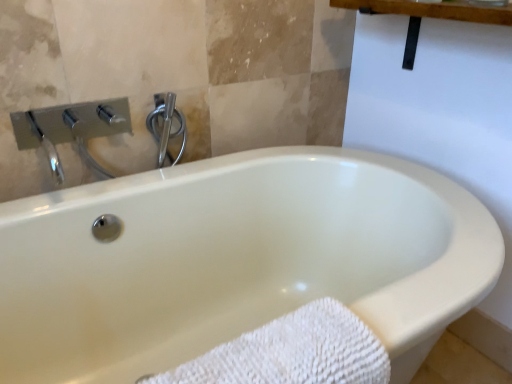
Describe the element at coordinates (166, 126) in the screenshot. This screenshot has width=512, height=384. I see `chrome/metallic shower handle at upper center` at that location.

This screenshot has height=384, width=512. I want to click on chrome/metallic shower handle at upper center, so click(166, 126).

What do you see at coordinates (292, 352) in the screenshot?
I see `white textured towel at lower left` at bounding box center [292, 352].

I want to click on white textured towel at lower left, so click(292, 352).

Locate an element on the screen. The image size is (512, 384). chrome/metallic shower handle at upper center is located at coordinates (166, 126).

Would you say white textured towel at lower left is to the left or to the right of chrome/metallic shower handle at upper center in the picture?

In the image, white textured towel at lower left appears on the right side of chrome/metallic shower handle at upper center.

Between white textured towel at lower left and chrome/metallic shower handle at upper center, which one is positioned in front?

white textured towel at lower left is in front.

Is point (368, 350) closer or farther from the camera than point (156, 123)?

Point (368, 350) is closer to the camera than point (156, 123).

From the picture: From the image's perspective, between white textured towel at lower left and chrome/metallic shower handle at upper center, who is located below?

white textured towel at lower left appears lower in the image.

From a real-world perspective, is white textured towel at lower left beneath chrome/metallic shower handle at upper center?

Yes, from a real-world perspective, white textured towel at lower left is below chrome/metallic shower handle at upper center.

Considering the sizes of white textured towel at lower left and chrome/metallic shower handle at upper center in the image, is white textured towel at lower left wider or thinner than chrome/metallic shower handle at upper center?

Clearly, white textured towel at lower left has more width compared to chrome/metallic shower handle at upper center.

Is white textured towel at lower left shorter than chrome/metallic shower handle at upper center?

No.

Is white textured towel at lower left smaller than chrome/metallic shower handle at upper center?

Actually, white textured towel at lower left might be larger than chrome/metallic shower handle at upper center.

Choose the correct answer: Is white textured towel at lower left inside chrome/metallic shower handle at upper center or outside it?

white textured towel at lower left is located beyond the bounds of chrome/metallic shower handle at upper center.

Is white textured towel at lower left not near chrome/metallic shower handle at upper center?

No.

Could you tell me if white textured towel at lower left is facing chrome/metallic shower handle at upper center?

No, white textured towel at lower left is not aimed at chrome/metallic shower handle at upper center.

Can you tell me how much white textured towel at lower left and chrome/metallic shower handle at upper center differ in facing direction?

The angle between the facing direction of white textured towel at lower left and the facing direction of chrome/metallic shower handle at upper center is 0.0691 degrees.

How far apart are white textured towel at lower left and chrome/metallic shower handle at upper center?

31.40 inches.

Find the location of a particular element. This screenshot has height=384, width=512. bath towel lying below the chrome/metallic shower handle at upper center (from the image's perspective) is located at coordinates click(292, 352).

Does chrome/metallic shower handle at upper center appear on the left side of white textured towel at lower left?

Yes, chrome/metallic shower handle at upper center is to the left of white textured towel at lower left.

Which object is closer to the camera taking this photo, chrome/metallic shower handle at upper center or white textured towel at lower left?

white textured towel at lower left.

Is point (163, 152) farther from camera compared to point (319, 311)?

Yes, point (163, 152) is farther from viewer.

From the image's perspective, is chrome/metallic shower handle at upper center under white textured towel at lower left?

No, from the image's perspective, chrome/metallic shower handle at upper center is not below white textured towel at lower left.

From a real-world perspective, is chrome/metallic shower handle at upper center located higher than white textured towel at lower left?

Yes, from a real-world perspective, chrome/metallic shower handle at upper center is over white textured towel at lower left

Can you confirm if chrome/metallic shower handle at upper center is thinner than white textured towel at lower left?

Yes.

From the picture: From their relative heights in the image, would you say chrome/metallic shower handle at upper center is taller or shorter than white textured towel at lower left?

chrome/metallic shower handle at upper center is shorter than white textured towel at lower left.

Is chrome/metallic shower handle at upper center smaller than white textured towel at lower left?

Yes.

Can white textured towel at lower left be found inside chrome/metallic shower handle at upper center?

No, white textured towel at lower left is not surrounded by chrome/metallic shower handle at upper center.

Are chrome/metallic shower handle at upper center and white textured towel at lower left making contact?

chrome/metallic shower handle at upper center and white textured towel at lower left are clearly separated.

Is chrome/metallic shower handle at upper center aimed at white textured towel at lower left?

Yes, chrome/metallic shower handle at upper center faces towards white textured towel at lower left.

The image size is (512, 384). Find the location of `bath towel that is below the chrome/metallic shower handle at upper center (from the image's perspective)`. bath towel that is below the chrome/metallic shower handle at upper center (from the image's perspective) is located at coordinates (292, 352).

The height and width of the screenshot is (384, 512). What are the coordinates of `bath towel on the right side of chrome/metallic shower handle at upper center` in the screenshot? It's located at (292, 352).

Where is `bath towel in front of the chrome/metallic shower handle at upper center`? The height and width of the screenshot is (384, 512). bath towel in front of the chrome/metallic shower handle at upper center is located at coordinates (292, 352).